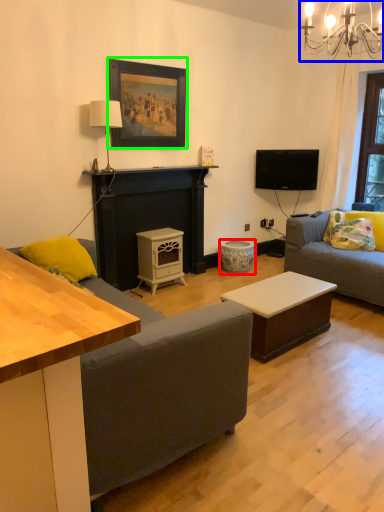
Question: Based on their relative distances, which object is farther from stool (highlighted by a red box)? Choose from light fixture (highlighted by a blue box) and picture frame (highlighted by a green box).

Choices:
 (A) light fixture
 (B) picture frame

Answer: (A)